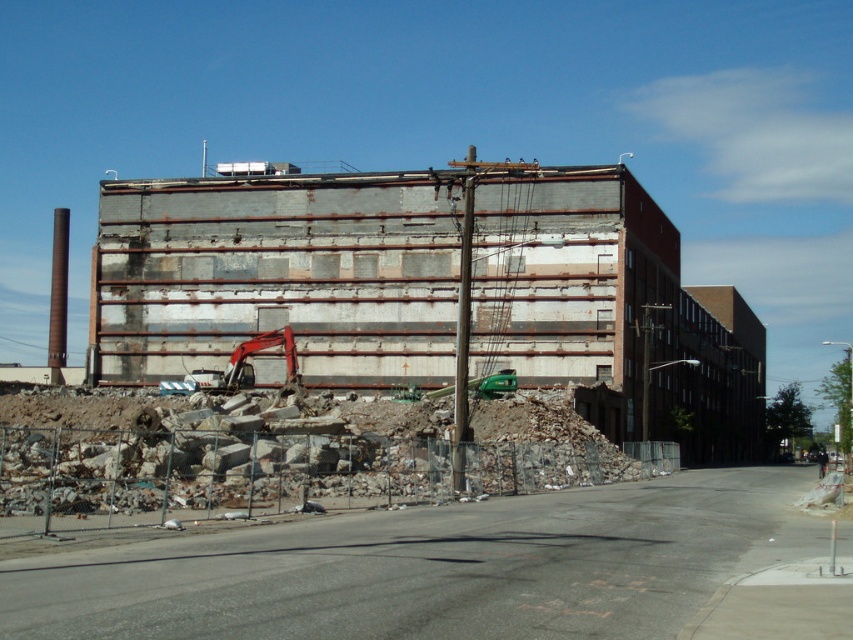
Can you confirm if rusty metal building at center is bigger than orange metallic excavator at center?

Yes, rusty metal building at center is bigger than orange metallic excavator at center.

Can you confirm if rusty metal building at center is positioned to the right of orange metallic excavator at center?

Yes, rusty metal building at center is to the right of orange metallic excavator at center.

Between point (112, 324) and point (281, 394), which one is positioned in front?

Point (281, 394) is more forward.

Where is `rusty metal building at center`? Image resolution: width=853 pixels, height=640 pixels. rusty metal building at center is located at coordinates (279, 275).